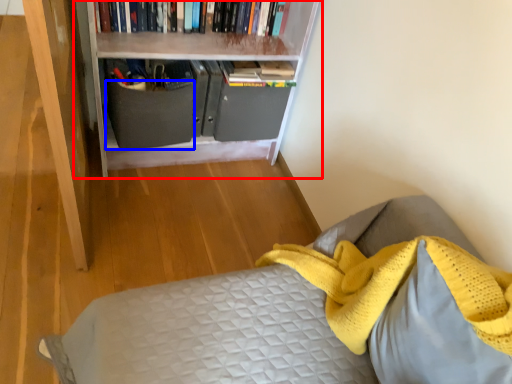
Question: Which object is further to the camera taking this photo, bookcase (highlighted by a red box) or drawer (highlighted by a blue box)?

Choices:
 (A) bookcase
 (B) drawer

Answer: (B)